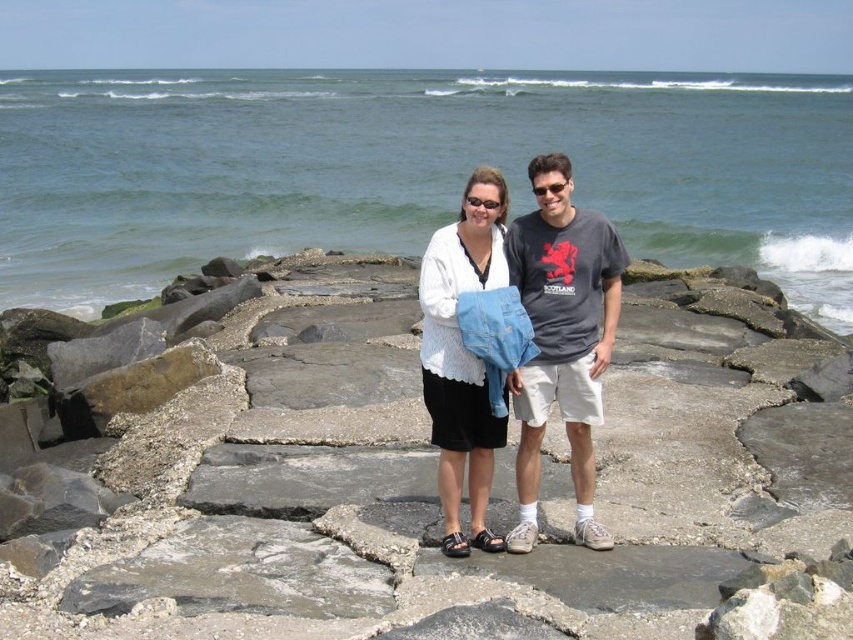
Question: Which point is farther from the camera taking this photo?

Choices:
 (A) (618, 310)
 (B) (219, 346)

Answer: (B)

Question: Is gray concrete at center wider than dark gray t-shirt at center?

Choices:
 (A) no
 (B) yes

Answer: (B)

Question: Based on their relative distances, which object is nearer to the blue water at center?

Choices:
 (A) white textured sweater at center
 (B) dark gray t-shirt at center
 (C) gray concrete at center

Answer: (C)

Question: Can you confirm if gray concrete at center is positioned to the left of blue water at center?

Choices:
 (A) no
 (B) yes

Answer: (B)

Question: Which object appears farthest from the camera in this image?

Choices:
 (A) gray concrete at center
 (B) dark gray t-shirt at center
 (C) white textured sweater at center

Answer: (C)

Question: Can you confirm if blue water at center is smaller than dark gray t-shirt at center?

Choices:
 (A) no
 (B) yes

Answer: (A)